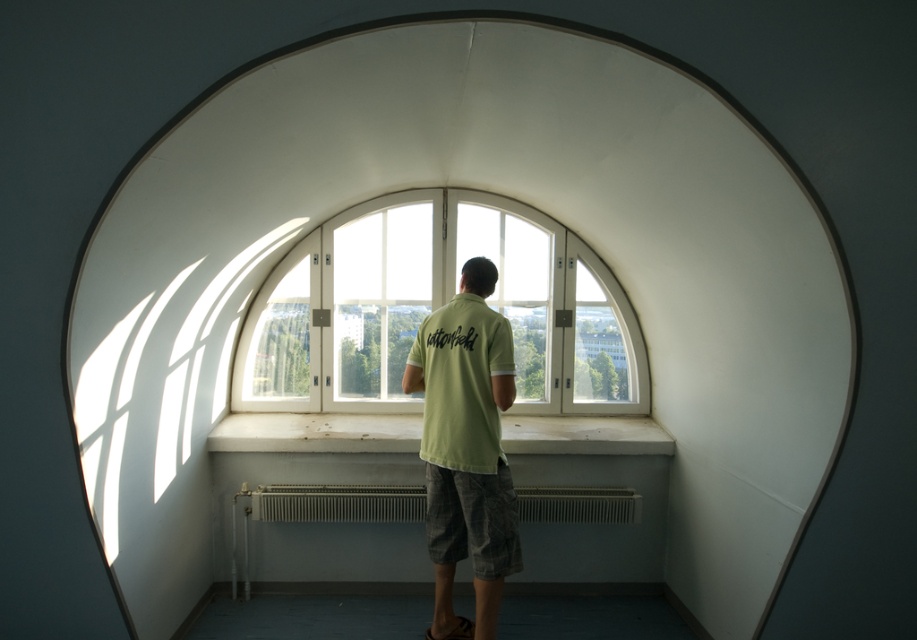
Question: Is light green t-shirt at center above green cotton t-shirt at center?

Choices:
 (A) yes
 (B) no

Answer: (B)

Question: Is clear glass window at center above light green t-shirt at center?

Choices:
 (A) no
 (B) yes

Answer: (B)

Question: Estimate the real-world distances between objects in this image. Which object is closer to the clear glass window at center?

Choices:
 (A) light green t-shirt at center
 (B) white metallic radiator at lower center
 (C) green cotton t-shirt at center
 (D) white metallic radiator at center

Answer: (D)

Question: Among these points, which one is nearest to the camera?

Choices:
 (A) (289, 280)
 (B) (437, 451)
 (C) (289, 515)

Answer: (B)

Question: Among these objects, which one is nearest to the camera?

Choices:
 (A) white metallic radiator at lower center
 (B) clear glass window at center
 (C) green cotton t-shirt at center

Answer: (C)

Question: Can you confirm if light green t-shirt at center is thinner than green cotton t-shirt at center?

Choices:
 (A) yes
 (B) no

Answer: (B)